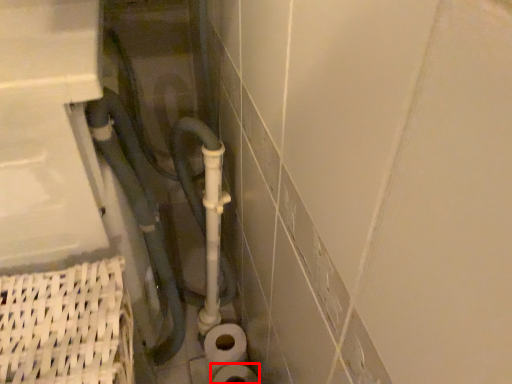
Question: From the image's perspective, what is the correct spatial relationship of toilet paper (annotated by the red box) in relation to water pipe?

Choices:
 (A) above
 (B) below

Answer: (B)